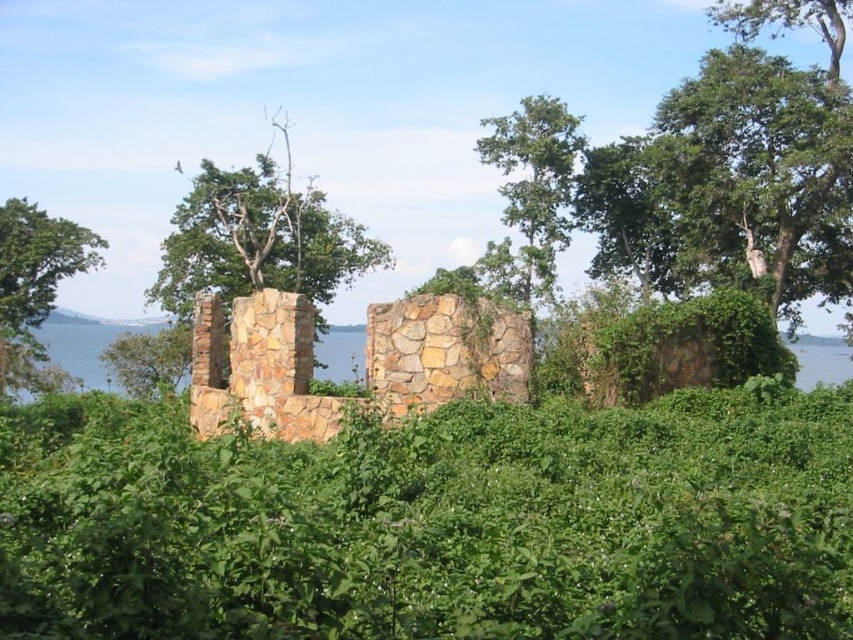
You are a hiker standing between the green leafy tree at upper right and the green leafy tree at left. You want to place a 50 meter long rope between them to hang a hammock. Will the rope be long enough?

The green leafy tree at upper right and green leafy tree at left are 56.64 meters apart. Since the rope is only 50 meters long, it will not be long enough to span the distance between them.

You are an archaeologist examining the ruins and need to determine which plant structure is taller between the green leafy hedge at center and the green leafy tree at upper center. Based on the scene, which one is taller?

The green leafy tree at upper center is taller than the green leafy hedge at center.